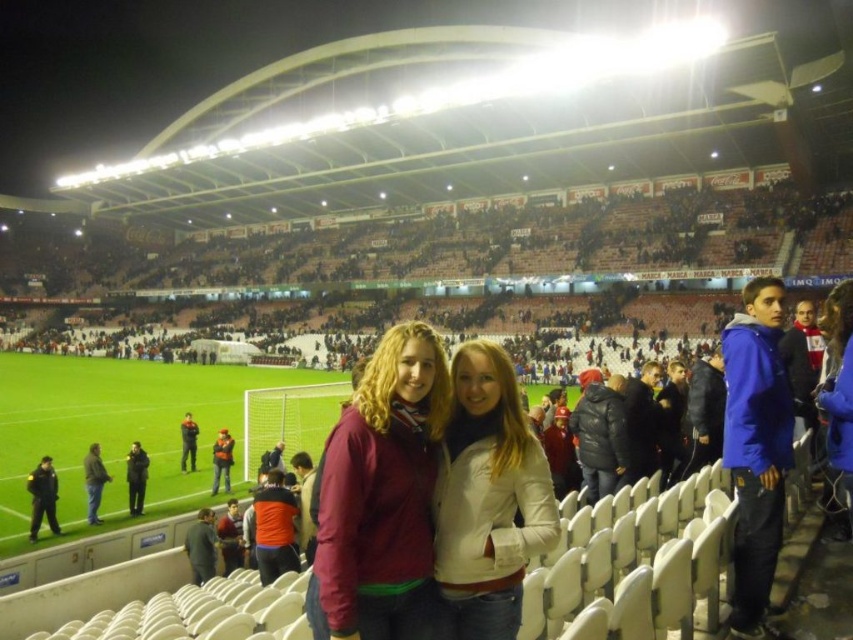
Question: Is dark blue uniform at center in front of orange fabric jacket at lower center?

Choices:
 (A) yes
 (B) no

Answer: (A)

Question: Which object appears farthest from the camera in this image?

Choices:
 (A) dark brown leather jacket at lower left
 (B) maroon fabric jacket at center
 (C) dark blue jacket at center
 (D) orange fabric jacket at lower center

Answer: (D)

Question: Estimate the real-world distances between objects in this image. Which object is farther from the dark blue uniform at center?

Choices:
 (A) dark brown leather jacket at lower left
 (B) dark blue jacket at center

Answer: (B)

Question: Is maroon fabric jacket at center wider than dark blue uniform at center?

Choices:
 (A) yes
 (B) no

Answer: (A)

Question: Which point appears closest to the camera in this image?

Choices:
 (A) (91, 468)
 (B) (224, 465)
 (C) (506, 426)
 (D) (369, 484)

Answer: (D)

Question: Can you confirm if white matte jacket at center is positioned below dark blue uniform at center?

Choices:
 (A) yes
 (B) no

Answer: (B)